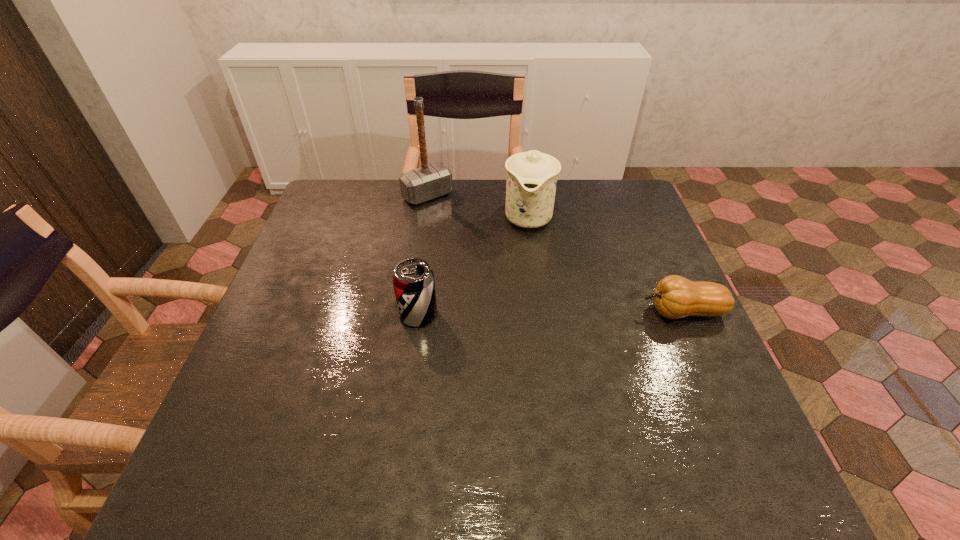
The width and height of the screenshot is (960, 540). In order to click on vacant area at the left edge in this screenshot , I will do `click(313, 327)`.

Find the location of a particular element. The width and height of the screenshot is (960, 540). blank space at the right edge of the desktop is located at coordinates (696, 364).

Identify the location of vacant space at the far right corner of the desktop. The width and height of the screenshot is (960, 540). (589, 201).

I want to click on free space between the soda can and the second object from right to left, so click(x=473, y=266).

Image resolution: width=960 pixels, height=540 pixels. What are the coordinates of `free space between the chinaware and the third tallest object` in the screenshot? It's located at (x=473, y=266).

The image size is (960, 540). Find the location of `free space between the third tallest object and the rightmost object`. free space between the third tallest object and the rightmost object is located at coordinates (550, 313).

Locate an element on the screen. This screenshot has width=960, height=540. unoccupied area between the soda can and the hammer is located at coordinates (422, 255).

This screenshot has width=960, height=540. I want to click on empty space that is in between the tallest object and the second shortest object, so click(x=422, y=255).

The image size is (960, 540). Find the location of `free spot between the soda can and the tallest object`. free spot between the soda can and the tallest object is located at coordinates (422, 255).

Identify the location of free space between the hammer and the third object from left to right. (478, 206).